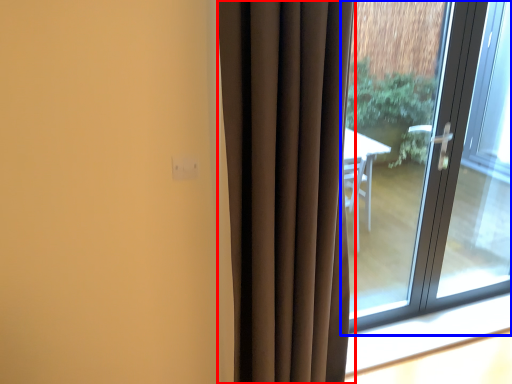
Question: Which of the following is the farthest to the observer, curtain (highlighted by a red box) or window (highlighted by a blue box)?

Choices:
 (A) curtain
 (B) window

Answer: (B)